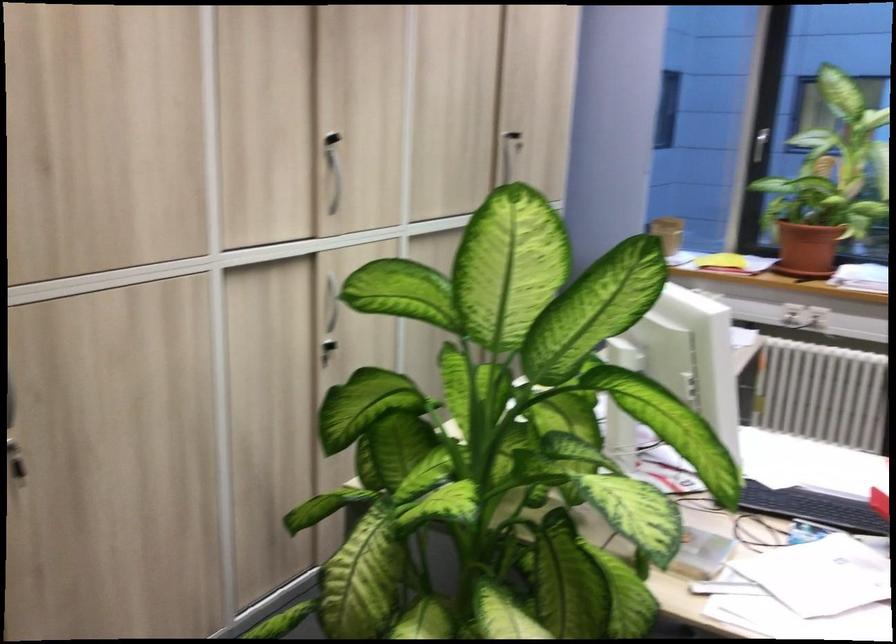
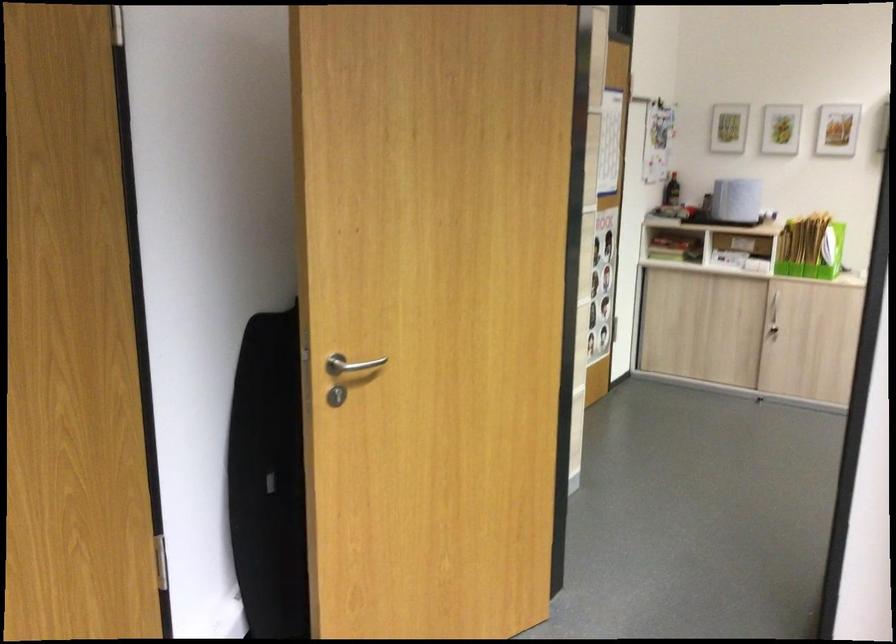
Question: The camera is either moving clockwise (left) or counter-clockwise (right) around the object. The first image is from the beginning of the video and the second image is from the end. Is the camera moving left or right when shooting the video?

Choices:
 (A) Left
 (B) Right

Answer: (B)